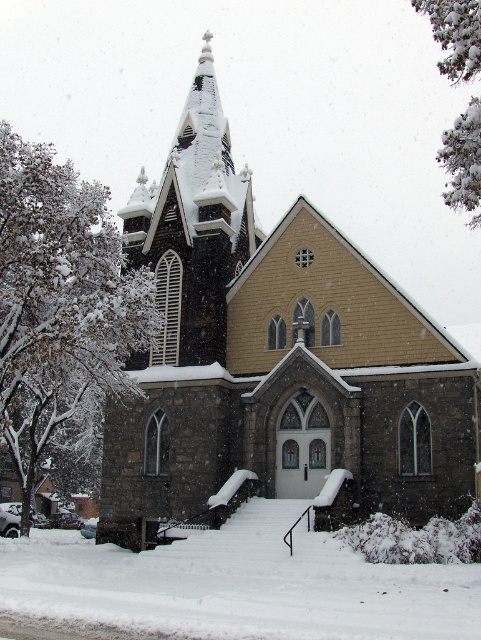
You are a delivery person standing at the edge of the church property. You need to deliver a package to the stone church at center. There is white fluffy snow at center in the way. Can you walk directly to the church without stepping on the snow?

The stone church at center and white fluffy snow at center are 15.06 meters apart from each other. Since the distance between them is significant, you can walk around the snow and reach the church without stepping on it.

You are standing at the base of the church and want to place a small decoration on the stone church at center. Where should you place it so that it sits above the white fluffy snow at center?

The stone church at center is above the white fluffy snow at center, so you should place the decoration on the stone church at center to ensure it sits above the snow.